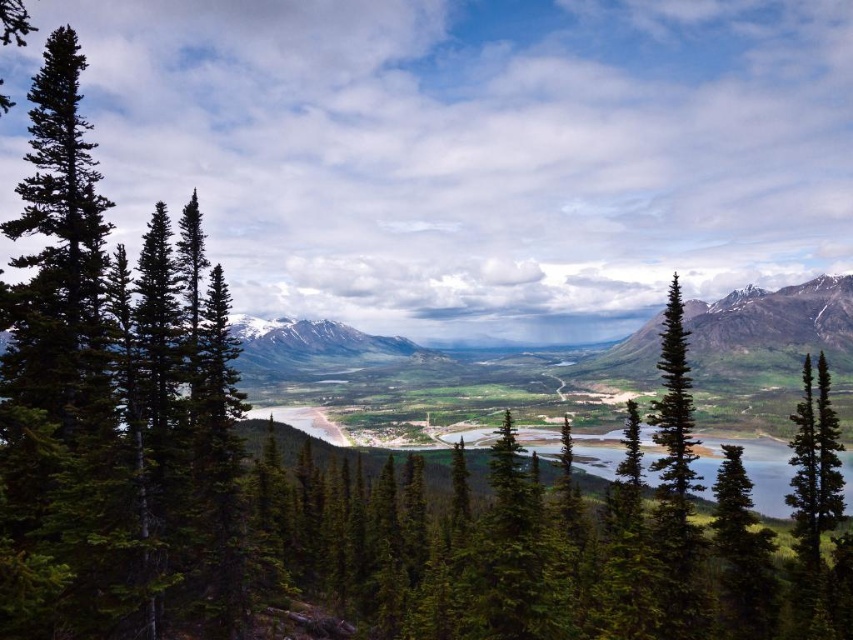
You are a hiker planning to take a photo of both the snowy granite mountain at upper right and the snowy granite mountain at center. Which mountain should you position yourself closer to in order to capture both in a single frame?

To capture both the snowy granite mountain at upper right and the snowy granite mountain at center in a single frame, you should position yourself closer to the snowy granite mountain at center. This is because the snowy granite mountain at upper right is above the snowy granite mountain at center, so by being nearer to the lower mountain, you can angle your camera upward to include both in the shot.

You are an environmental scientist studying the elevation differences in this mountainous area. Based on the image, which object has a higher elevation, the snowy granite mountain at upper right or the green matte tree at center?

The snowy granite mountain at upper right has a greater height compared to the green matte tree at center, so the snowy granite mountain at upper right has a higher elevation.